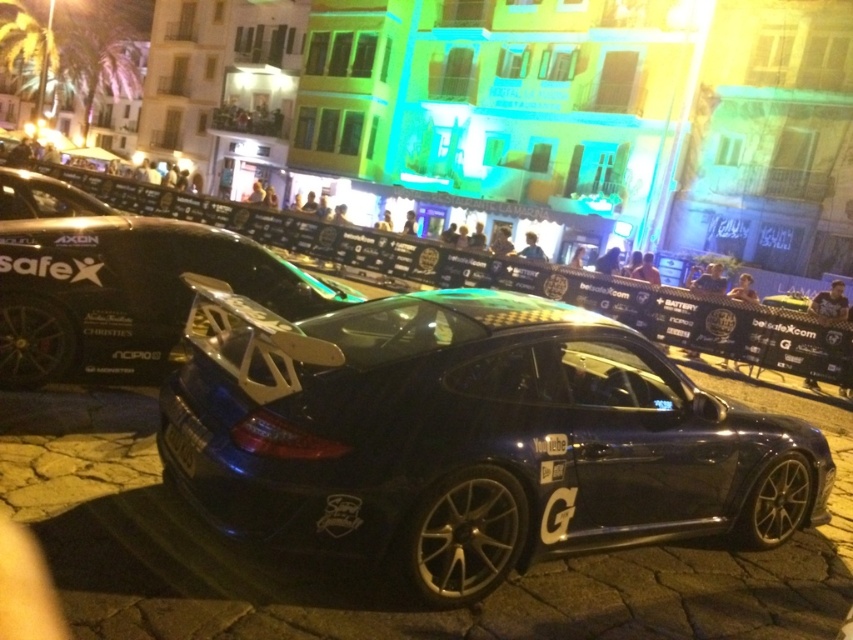
Question: Does glossy carbon fiber sports car at center appear over glossy carbon fiber car at center?

Choices:
 (A) yes
 (B) no

Answer: (B)

Question: Is glossy carbon fiber sports car at center closer to the viewer compared to glossy carbon fiber car at center?

Choices:
 (A) no
 (B) yes

Answer: (B)

Question: Which of the following is the closest to the observer?

Choices:
 (A) (741, 428)
 (B) (38, 180)

Answer: (A)

Question: Which of the following is the closest to the observer?

Choices:
 (A) glossy carbon fiber sports car at center
 (B) glossy carbon fiber car at center

Answer: (A)

Question: Is glossy carbon fiber sports car at center to the left of glossy carbon fiber car at center from the viewer's perspective?

Choices:
 (A) yes
 (B) no

Answer: (B)

Question: Which point appears farthest from the camera in this image?

Choices:
 (A) (56, 259)
 (B) (387, 449)

Answer: (A)